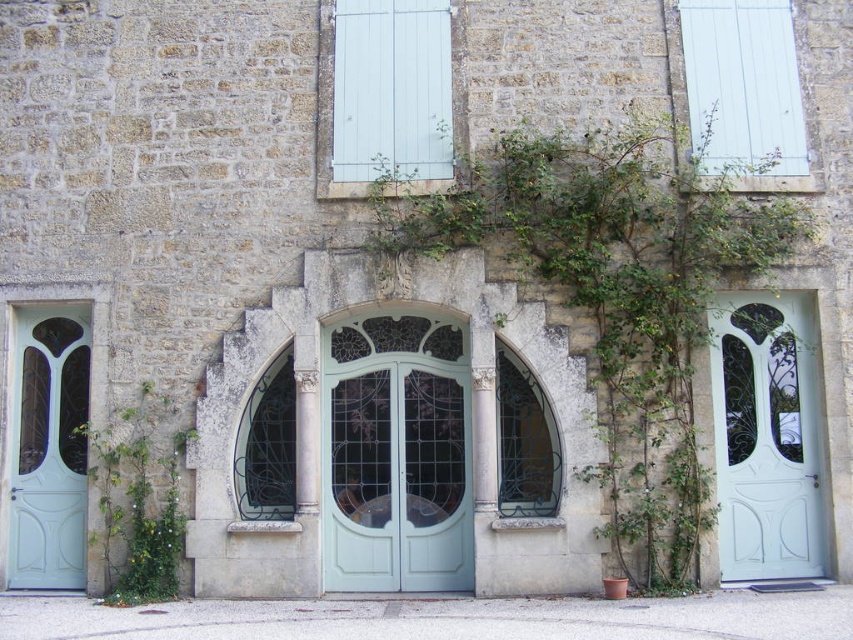
In the scene shown: You are standing in front of the stone building and notice a green leafy plant at center and white painted wood shutters at upper right. Which object is taller?

The green leafy plant at center is much taller than the white painted wood shutters at upper right.

You are a painter standing in front of the stone building. You need to paint the green leafy plant at center and the white painted wood at upper center. Which object requires more paint to cover its entire width?

The green leafy plant at center requires more paint to cover its entire width since its width surpasses that of the white painted wood at upper center.

You are standing in front of the stone building and notice a green leafy plant at center. Can you confirm if the point marked at coordinates (614, 292) corresponds to the location of the green leafy plant at center?

Yes, the green leafy plant at center is represented by point (614, 292).